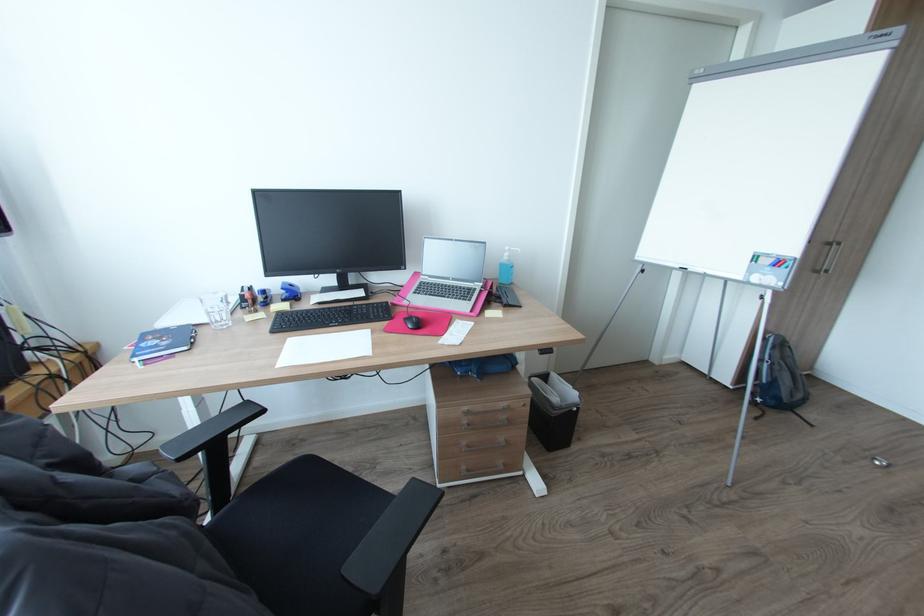
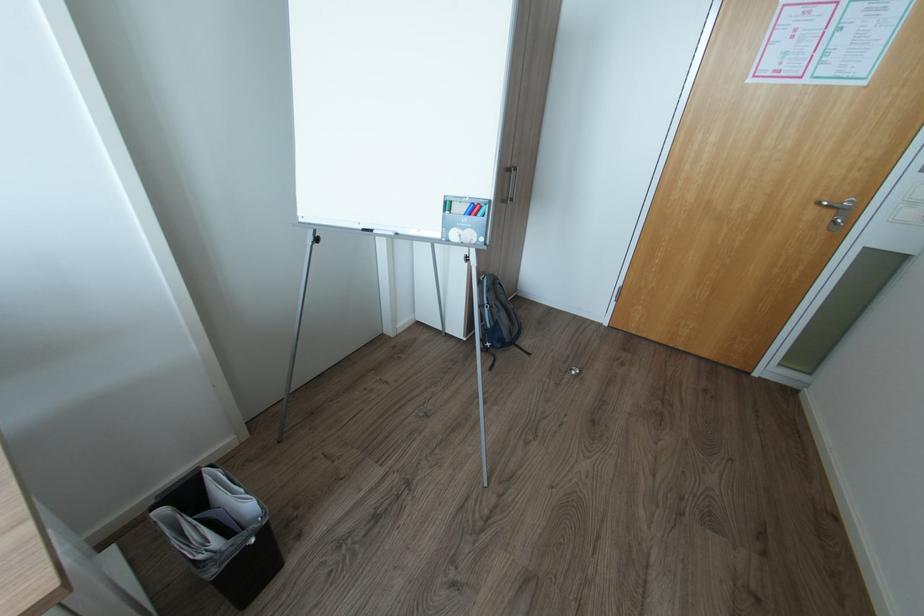
Find the pixel in the second image that matches point (580, 408) in the first image.

(257, 541)